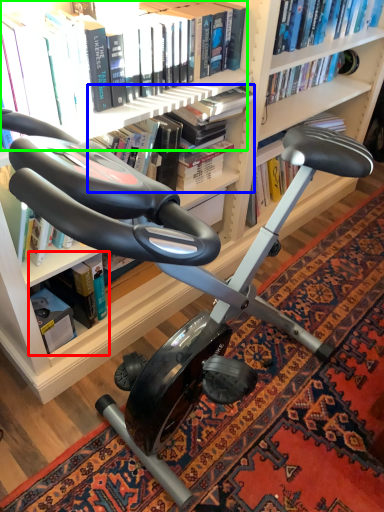
Question: Estimate the real-world distances between objects in this image. Which object is closer to book (highlighted by a red box), book (highlighted by a blue box) or book (highlighted by a green box)?

Choices:
 (A) book
 (B) book

Answer: (A)